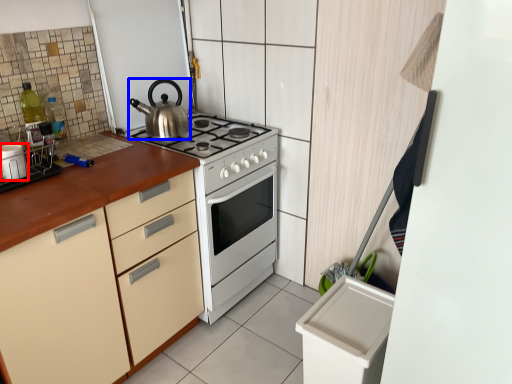
Question: Which object is further to the camera taking this photo, kitchen appliance (highlighted by a red box) or kettle (highlighted by a blue box)?

Choices:
 (A) kitchen appliance
 (B) kettle

Answer: (B)